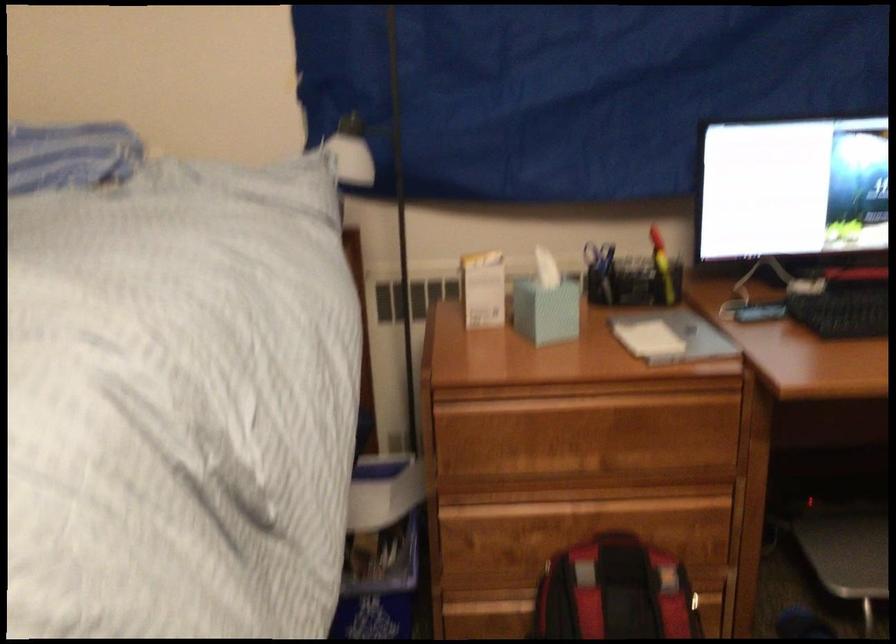
Image resolution: width=896 pixels, height=644 pixels. Describe the element at coordinates (478, 601) in the screenshot. I see `a bottom drawer pull` at that location.